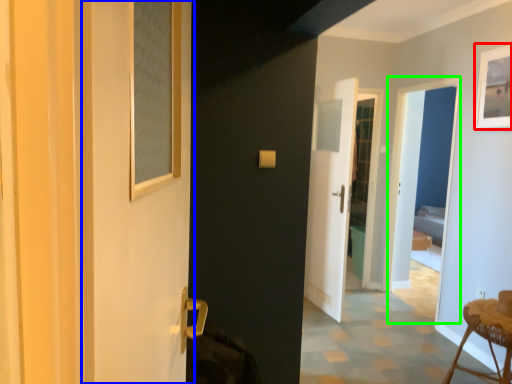
Question: Which object is positioned farthest from picture frame (highlighted by a red box)? Select from screen door (highlighted by a blue box) and screen door (highlighted by a green box).

Choices:
 (A) screen door
 (B) screen door

Answer: (A)